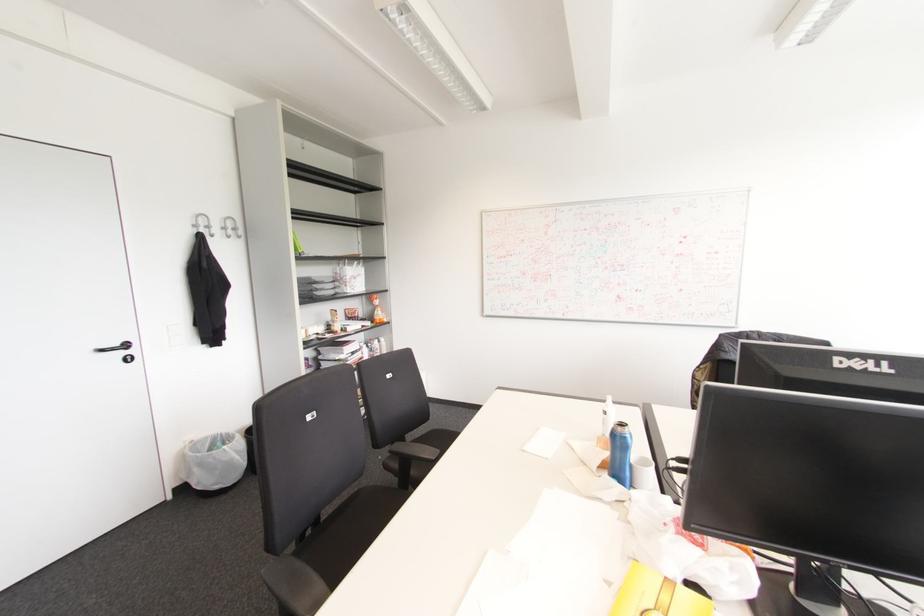
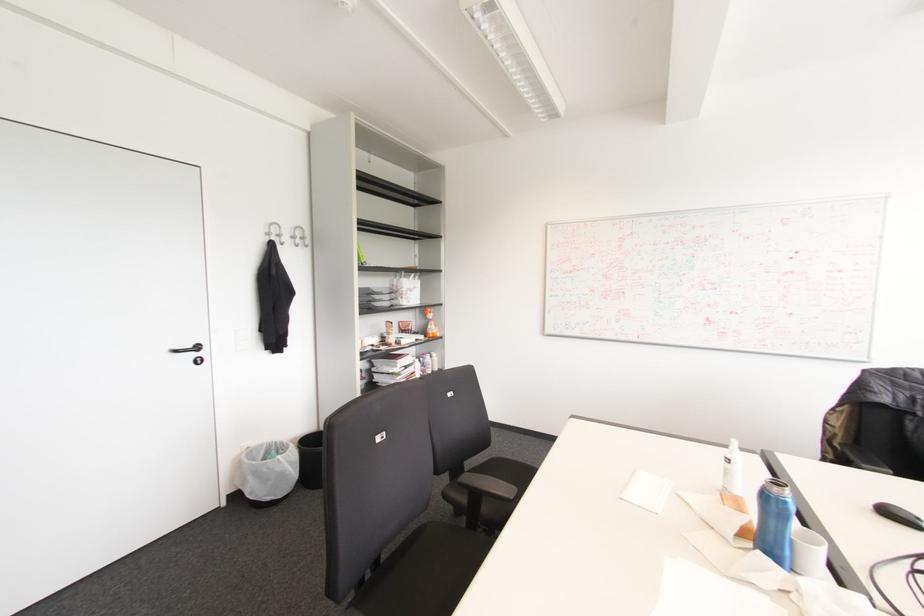
In the second image, find the point that corresponds to the point at 625,438 in the first image.

(784, 503)